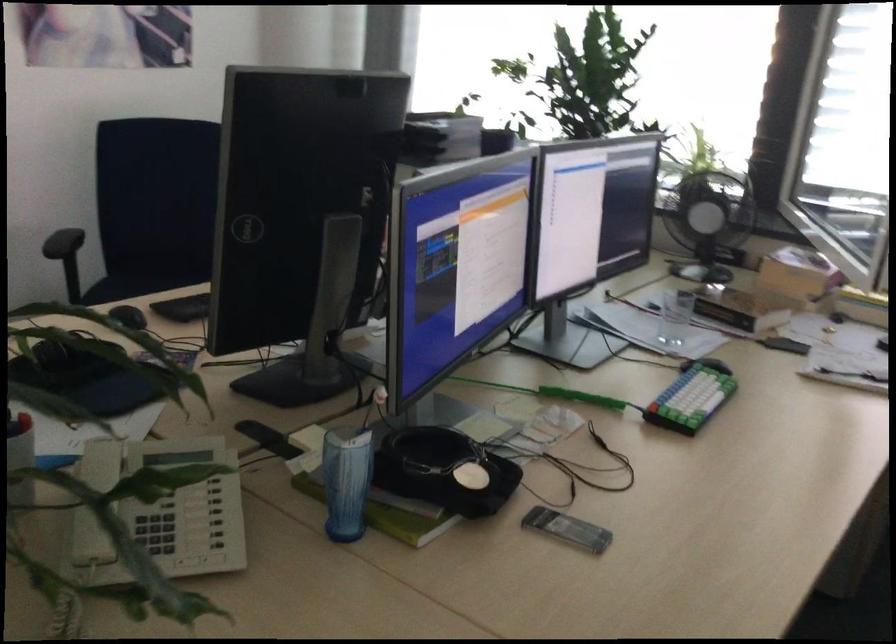
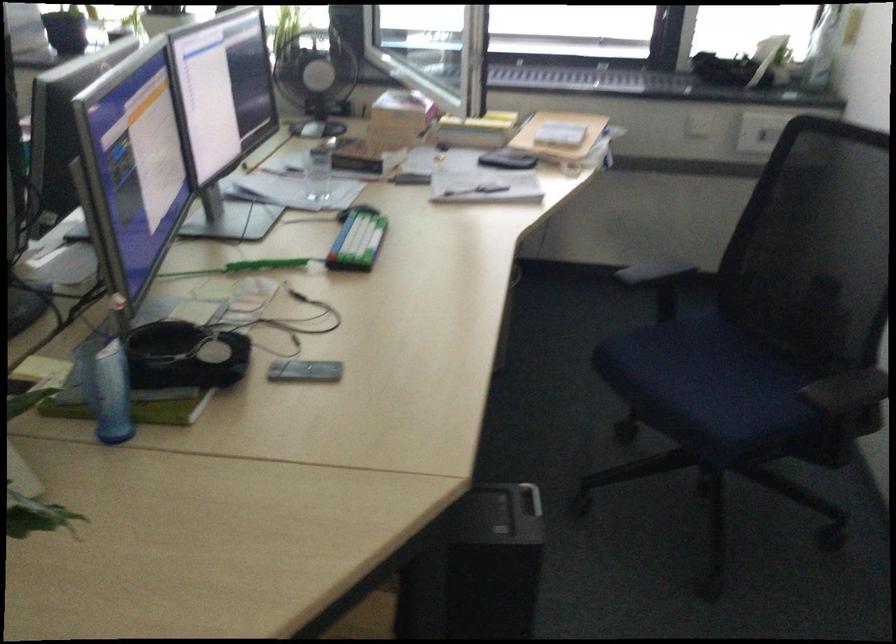
In the second image, find the point that corresponds to point 564,532 in the first image.

(305, 371)